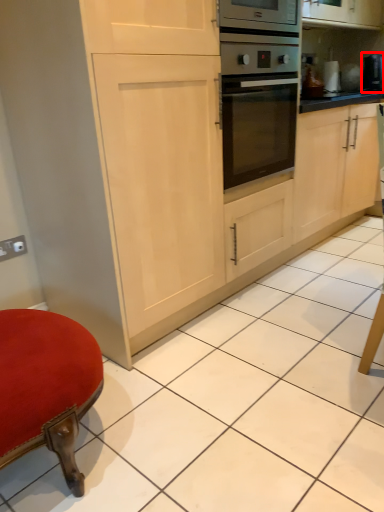
Question: Considering the relative positions of appliance (annotated by the red box) and electric outlet in the image provided, where is appliance (annotated by the red box) located with respect to the staircase?

Choices:
 (A) left
 (B) right

Answer: (B)